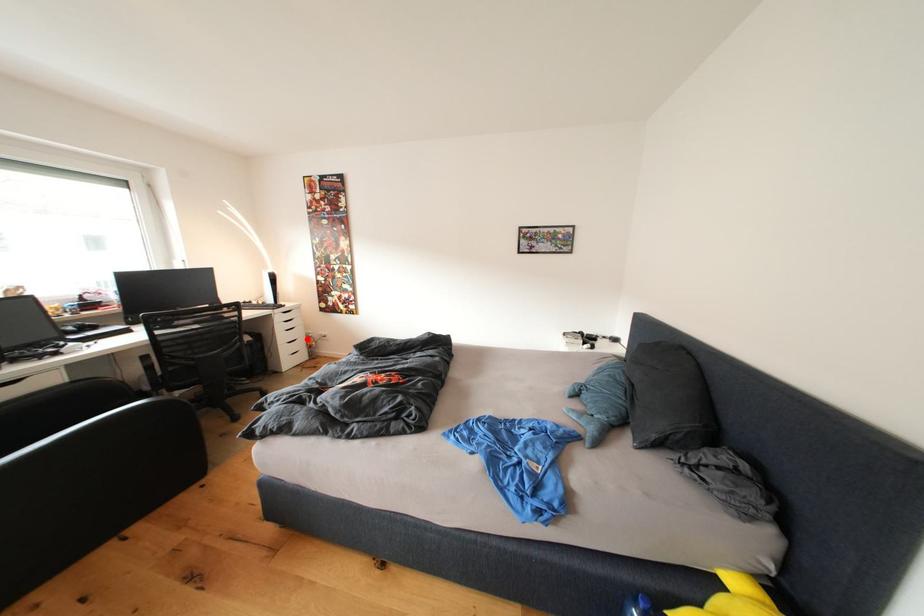
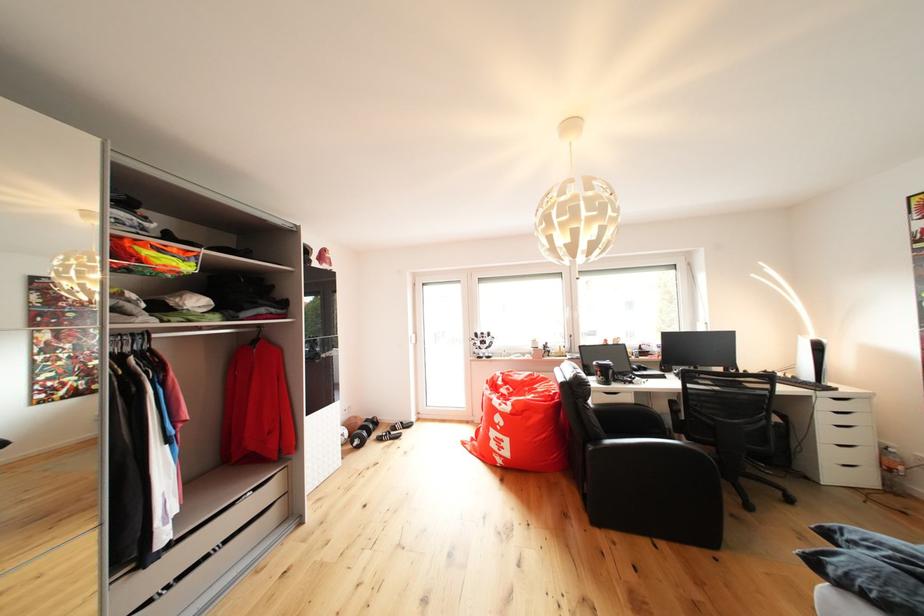
Question: I am providing you with two images of the same scene from different viewpoints. Image1 has a red point marked. In image2, the corresponding 3D location appears at what relative position? Reply with the corresponding letter.

Choices:
 (A) Closer
 (B) Farther

Answer: (B)